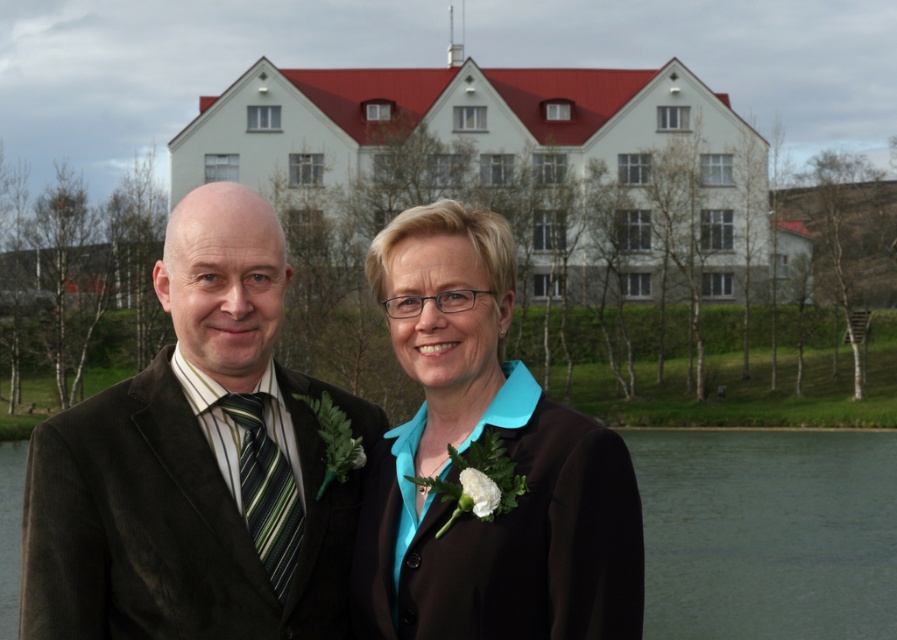
In the scene shown: You are standing in front of the building with a red roof and white walls. There are two points marked in the image. The first point is at coordinates point (607, 604) and the second point is at point (16, 451). Which of these two points is closer to you?

Point (607, 604) is closer to the viewer than point (16, 451).

Looking at this image, you are standing on the grassy hillside and want to walk to the brown corduroy suit at left. Which direction should you head relative to the transparent water at lower center?

The brown corduroy suit at left is to the right of the transparent water at lower center, so you should head towards the right side of the transparent water at lower center to reach it.

Consider the image. You are standing in front of the large building with a red roof and white walls. You see a point marked at coordinates (503, 458). What object is located at that point?

The point at coordinates (503, 458) marks the teal matte blazer at center.